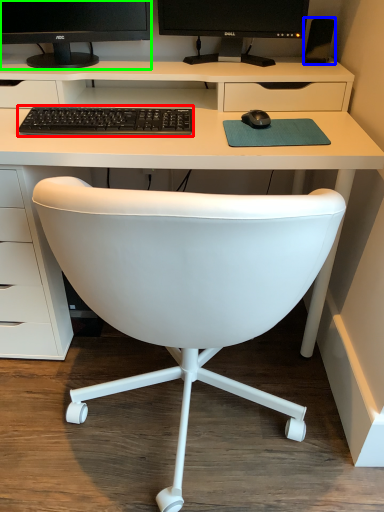
Question: Estimate the real-world distances between objects in this image. Which object is closer to computer keyboard (highlighted by a red box), speaker (highlighted by a blue box) or computer monitor (highlighted by a green box)?

Choices:
 (A) speaker
 (B) computer monitor

Answer: (B)